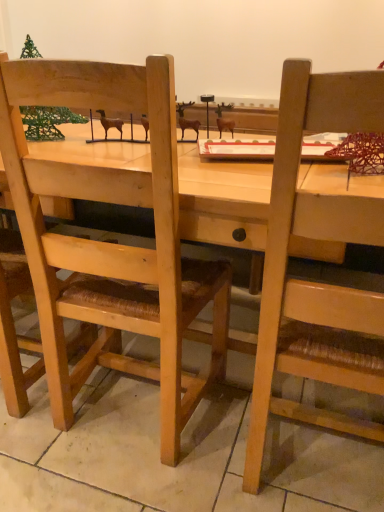
Question: From the image's perspective, is wooden chair at right, which appears as the 2th chair when viewed from the left, on green wire christmas tree at upper left?

Choices:
 (A) yes
 (B) no

Answer: (B)

Question: Does wooden chair at right, arranged as the 1th chair when viewed from the right, have a larger size compared to green wire christmas tree at upper left?

Choices:
 (A) yes
 (B) no

Answer: (A)

Question: Is wooden chair at right, which appears as the 2th chair when viewed from the left, at the right side of green wire christmas tree at upper left?

Choices:
 (A) yes
 (B) no

Answer: (A)

Question: Is wooden chair at right, arranged as the 1th chair when viewed from the right, turned away from green wire christmas tree at upper left?

Choices:
 (A) no
 (B) yes

Answer: (A)

Question: From the image's perspective, is wooden chair at right, which appears as the 2th chair when viewed from the left, under green wire christmas tree at upper left?

Choices:
 (A) no
 (B) yes

Answer: (B)

Question: From the image's perspective, is wooden chair at right, arranged as the 1th chair when viewed from the right, positioned above or below wooden chair at left, the first chair when ordered from left to right?

Choices:
 (A) above
 (B) below

Answer: (B)

Question: Does point (291, 229) appear closer or farther from the camera than point (0, 248)?

Choices:
 (A) closer
 (B) farther

Answer: (A)

Question: Looking at their shapes, would you say wooden chair at right, which appears as the 2th chair when viewed from the left, is wider or thinner than wooden chair at left, the first chair when ordered from left to right?

Choices:
 (A) wide
 (B) thin

Answer: (A)

Question: From a real-world perspective, is wooden chair at right, which appears as the 2th chair when viewed from the left, above or below wooden chair at left, which appears as the second chair when viewed from the right?

Choices:
 (A) below
 (B) above

Answer: (A)

Question: Considering the positions of wooden chair at right, which appears as the 2th chair when viewed from the left, and green wire christmas tree at upper left in the image, is wooden chair at right, which appears as the 2th chair when viewed from the left, bigger or smaller than green wire christmas tree at upper left?

Choices:
 (A) big
 (B) small

Answer: (A)

Question: Based on their positions, is wooden chair at right, which appears as the 2th chair when viewed from the left, located to the left or right of green wire christmas tree at upper left?

Choices:
 (A) right
 (B) left

Answer: (A)

Question: From a real-world perspective, is wooden chair at right, which appears as the 2th chair when viewed from the left, above or below green wire christmas tree at upper left?

Choices:
 (A) below
 (B) above

Answer: (A)

Question: Considering the positions of wooden chair at right, arranged as the 1th chair when viewed from the right, and green wire christmas tree at upper left in the image, is wooden chair at right, arranged as the 1th chair when viewed from the right, wider or thinner than green wire christmas tree at upper left?

Choices:
 (A) wide
 (B) thin

Answer: (A)

Question: Is point (6, 275) closer or farther from the camera than point (339, 304)?

Choices:
 (A) closer
 (B) farther

Answer: (B)

Question: From a real-world perspective, is wooden chair at left, the first chair when ordered from left to right, positioned above or below wooden chair at right, which appears as the 2th chair when viewed from the left?

Choices:
 (A) below
 (B) above

Answer: (B)